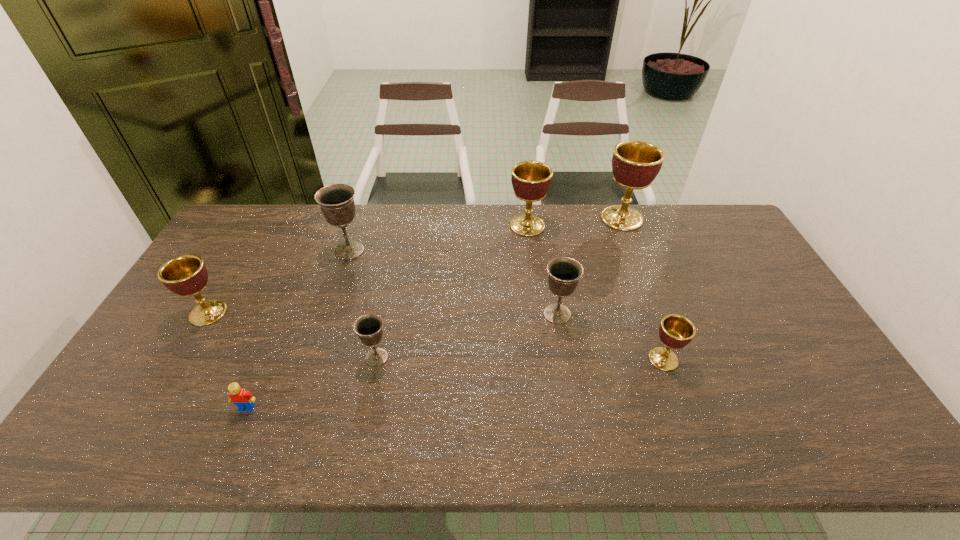
Image resolution: width=960 pixels, height=540 pixels. What are the coordinates of `the tallest object` in the screenshot? It's located at (635, 164).

Locate an element on the screen. the biggest golden chalice is located at coordinates tap(635, 164).

Find the location of `the third golden chalice from right to left`. the third golden chalice from right to left is located at coordinates (531, 180).

I want to click on the sixth object from right to left, so click(x=337, y=204).

Identify the location of the third farthest chalice. (337, 204).

This screenshot has height=540, width=960. Identify the location of the leftmost golden chalice. (186, 276).

You are a GUI agent. You are given a task and a screenshot of the screen. Output one action in this format:
    pyautogui.click(x=<x>, y=<y>)
    Task: Click on the leftmost object
    Image resolution: width=960 pixels, height=540 pixels.
    Given the screenshot: What is the action you would take?
    pyautogui.click(x=186, y=276)

Find the location of a particular element. the second farthest bronze chalice is located at coordinates (564, 272).

This screenshot has height=540, width=960. What are the coordinates of `the second biggest bronze chalice` in the screenshot? It's located at (564, 272).

The width and height of the screenshot is (960, 540). Identify the location of the second bronze chalice from left to right. (368, 327).